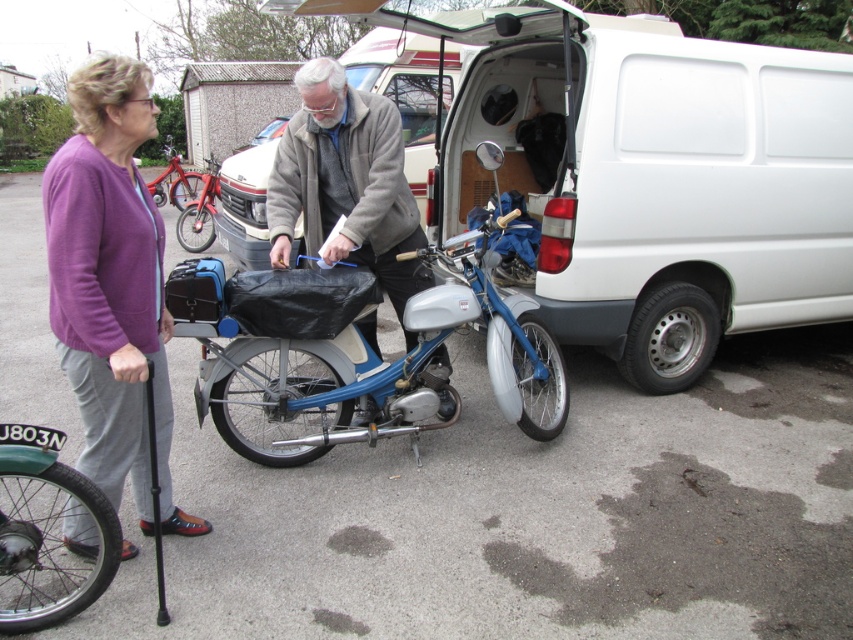
You are standing in the parking area and see the gray woolen jacket at center and the green rubber tire at lower left. Which object is positioned more to the right?

The gray woolen jacket at center is positioned more to the right than the green rubber tire at lower left.

You are standing at the point marked by coordinates point (346, 182) in the image. What object is directly in front of you?

The point (346, 182) corresponds to the gray woolen jacket at center, so the gray woolen jacket at center is directly in front of you.